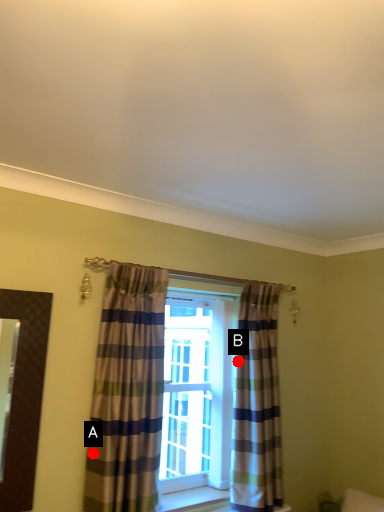
Question: Two points are circled on the image, labeled by A and B beside each circle. Which point is closer to the camera taking this photo?

Choices:
 (A) A is closer
 (B) B is closer

Answer: (A)